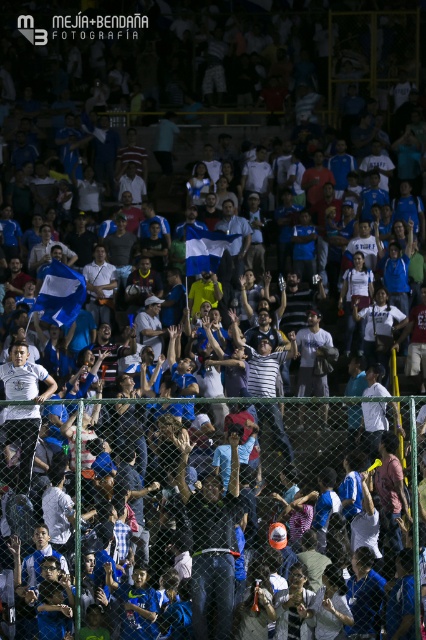
Is dark gray fabric jacket at center smaller than white fabric flag at center?

Yes, dark gray fabric jacket at center is smaller than white fabric flag at center.

Which is more to the right, dark gray fabric jacket at center or white fabric flag at center?

From the viewer's perspective, dark gray fabric jacket at center appears more on the right side.

Between point (230, 540) and point (195, 243), which one is positioned behind?

The point (195, 243) is more distant.

Locate an element on the screen. The height and width of the screenshot is (640, 426). dark gray fabric jacket at center is located at coordinates (210, 545).

Which is more to the left, dark gray fabric jacket at center or blue fabric flag at center?

blue fabric flag at center is more to the left.

Is dark gray fabric jacket at center wider than blue fabric flag at center?

Incorrect, dark gray fabric jacket at center's width does not surpass blue fabric flag at center's.

This screenshot has height=640, width=426. Describe the element at coordinates (210, 545) in the screenshot. I see `dark gray fabric jacket at center` at that location.

Image resolution: width=426 pixels, height=640 pixels. I want to click on dark gray fabric jacket at center, so click(x=210, y=545).

What do you see at coordinates (60, 294) in the screenshot?
I see `blue fabric flag at center` at bounding box center [60, 294].

Does blue fabric flag at center appear on the right side of white fabric flag at center?

In fact, blue fabric flag at center is to the left of white fabric flag at center.

Image resolution: width=426 pixels, height=640 pixels. In order to click on blue fabric flag at center in this screenshot , I will do `click(60, 294)`.

In order to click on blue fabric flag at center in this screenshot , I will do `click(60, 294)`.